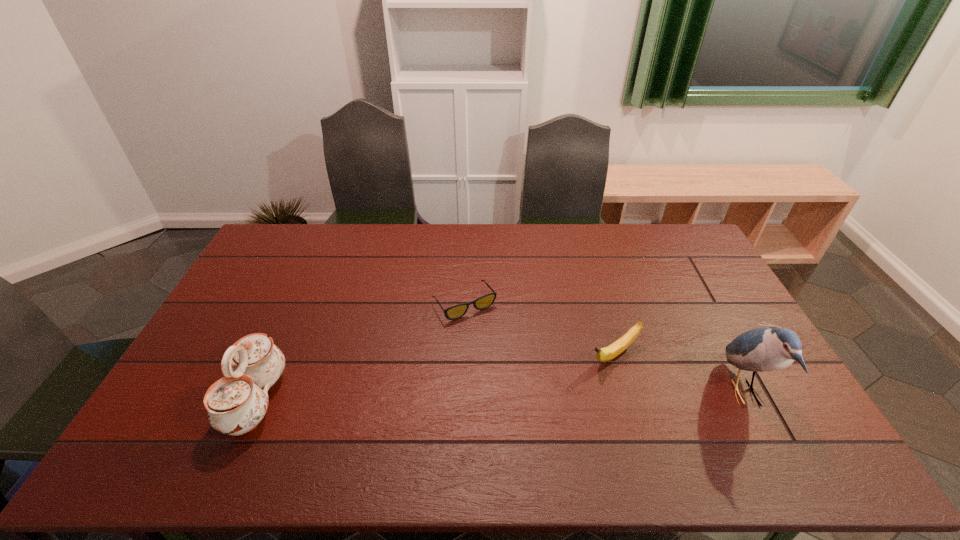
Identify the location of free space that is in between the third object from left to right and the tallest object. This screenshot has width=960, height=540. (679, 373).

You are a GUI agent. You are given a task and a screenshot of the screen. Output one action in this format:
    pyautogui.click(x=<x>, y=<y>)
    Task: Click on the free space between the leftmost object and the farthest object
    This screenshot has width=960, height=540.
    Given the screenshot: What is the action you would take?
    coord(361,352)

The height and width of the screenshot is (540, 960). Identify the location of vacant area that lies between the tallest object and the leftmost object. (500, 396).

This screenshot has width=960, height=540. In order to click on vacant space in between the second object from right to left and the third shortest object in this screenshot , I will do `click(435, 377)`.

Locate which object ranks third in proximity to the banana. Please provide its 2D coordinates. Your answer should be formatted as a tuple, i.e. [(x, y)], where the tuple contains the x and y coordinates of a point satisfying the conditions above.

[(236, 403)]

Point out which object is positioned as the nearest to the tallest object. Please provide its 2D coordinates. Your answer should be formatted as a tuple, i.e. [(x, y)], where the tuple contains the x and y coordinates of a point satisfying the conditions above.

[(608, 353)]

Locate an element on the screen. free space that satisfies the following two spatial constraints: 1. on the front side of the rightmost object; 2. at the tip of the third object from right to left's beak is located at coordinates (461, 392).